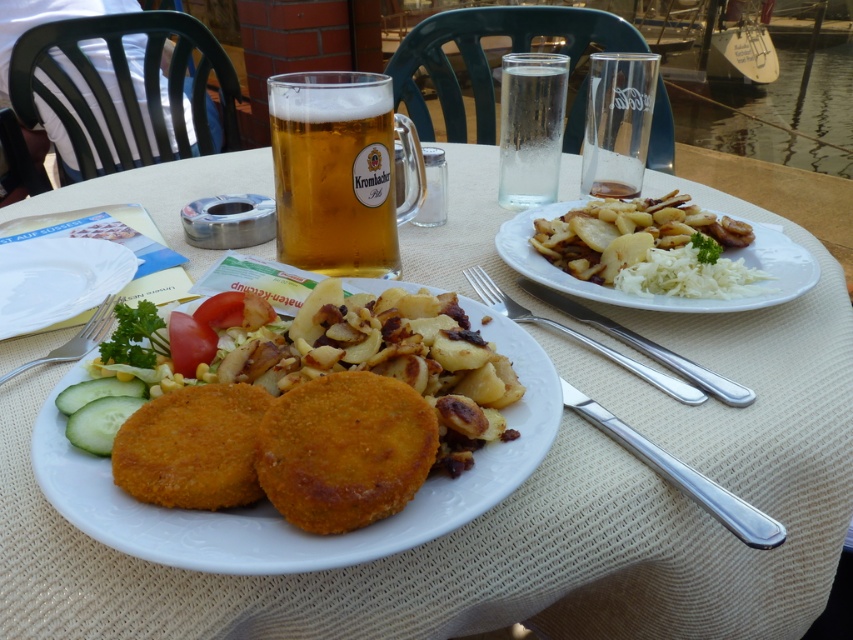
Based on the photo, you are a waiter at this outdoor dining area and need to place a new menu on the table. The menu is 10 cm wide. You see the clear glass water at upper center and the green crisp cucumber at center. Which object should you place the menu next to so that it fits without overlapping?

The clear glass water at upper center has a greater width than the green crisp cucumber at center. Since the menu is 10 cm wide, you should place it next to the clear glass water at upper center because its width allows more space for the menu without overlapping.

You are a waiter holding a tray of dishes. You need to place the clear glass water at upper center back to the kitchen. The kitchen is located behind you. Can you walk directly backward without moving the tray to pick up the glass?

The clear glass water at upper center is 20.55 inches away from camera. Since the distance is sufficient, you can walk directly backward to pick it up without needing to adjust the tray.

You are a waiter who needs to place a 40 cm long tray between the clear glass water at upper center and the green crisp cucumber at center on the table. Will the tray fit between them without overlapping either item?

The clear glass water at upper center and the green crisp cucumber at center are 38.72 centimeters apart. Since the tray is 40 cm long, it will not fit between them without overlapping because the distance between the items is shorter than the tray length.